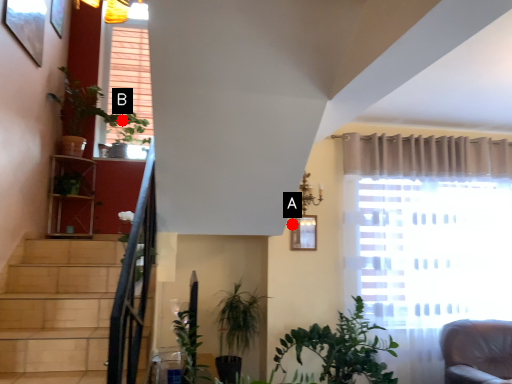
Question: Two points are circled on the image, labeled by A and B beside each circle. Which point is farther to the camera?

Choices:
 (A) A is further
 (B) B is further

Answer: (B)